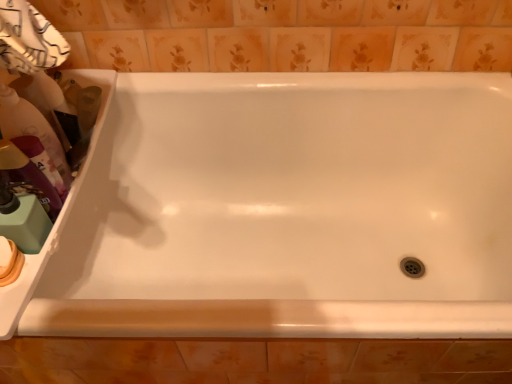
Question: Is beige matte soap at lower left positioned beyond the bounds of matte green pump at left, which is counted as the fourth cleaning product, starting from the top?

Choices:
 (A) yes
 (B) no

Answer: (A)

Question: Is matte green pump at left, which is counted as the fourth cleaning product, starting from the top, completely or partially inside beige matte soap at lower left?

Choices:
 (A) yes
 (B) no

Answer: (B)

Question: From the image's perspective, is beige matte soap at lower left under matte green pump at left, which is counted as the fourth cleaning product, starting from the top?

Choices:
 (A) yes
 (B) no

Answer: (A)

Question: Is beige matte soap at lower left far away from matte green pump at left, which is counted as the fourth cleaning product, starting from the top?

Choices:
 (A) yes
 (B) no

Answer: (B)

Question: From a real-world perspective, is beige matte soap at lower left located higher than matte green pump at left, which is counted as the fourth cleaning product, starting from the top?

Choices:
 (A) no
 (B) yes

Answer: (A)

Question: Is beige matte soap at lower left smaller than matte green pump at left, acting as the 1th cleaning product starting from the bottom?

Choices:
 (A) yes
 (B) no

Answer: (A)

Question: Would you say matte plastic bottle at left, positioned as the 4th cleaning product in bottom-to-top order, is outside white glossy sink at left?

Choices:
 (A) yes
 (B) no

Answer: (A)

Question: From a real-world perspective, is matte plastic bottle at left, which ranks as the 1th cleaning product in top-to-bottom order, positioned over white glossy sink at left based on gravity?

Choices:
 (A) yes
 (B) no

Answer: (A)

Question: Does matte plastic bottle at left, which ranks as the 1th cleaning product in top-to-bottom order, have a lesser height compared to white glossy sink at left?

Choices:
 (A) yes
 (B) no

Answer: (B)

Question: Is matte plastic bottle at left, which ranks as the 1th cleaning product in top-to-bottom order, wider than white glossy sink at left?

Choices:
 (A) no
 (B) yes

Answer: (A)

Question: From the image's perspective, is matte plastic bottle at left, positioned as the 4th cleaning product in bottom-to-top order, over white glossy sink at left?

Choices:
 (A) no
 (B) yes

Answer: (B)

Question: Is matte plastic bottle at left, positioned as the 4th cleaning product in bottom-to-top order, to the left of white glossy sink at left from the viewer's perspective?

Choices:
 (A) no
 (B) yes

Answer: (A)

Question: Is the position of white glossy sink at left more distant than that of matte plastic bottle at left, which ranks as the 1th cleaning product in top-to-bottom order?

Choices:
 (A) no
 (B) yes

Answer: (A)